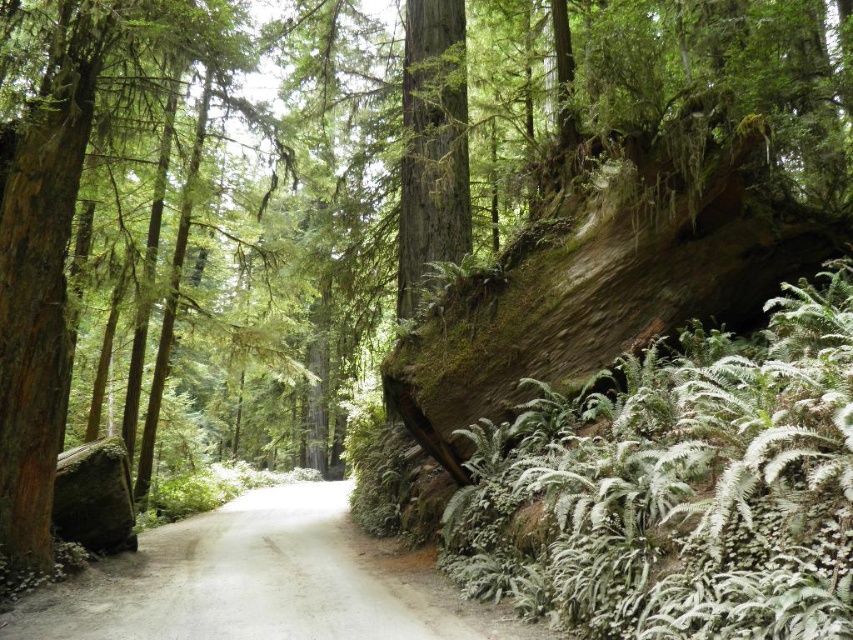
Between gray concrete road at center and smooth brown tree trunk at center, which one has less height?

gray concrete road at center is shorter.

Does point (350, 620) come in front of point (432, 150)?

Yes, point (350, 620) is in front of point (432, 150).

The image size is (853, 640). Find the location of `gray concrete road at center`. gray concrete road at center is located at coordinates (263, 582).

Identify the location of gray concrete road at center. The image size is (853, 640). (263, 582).